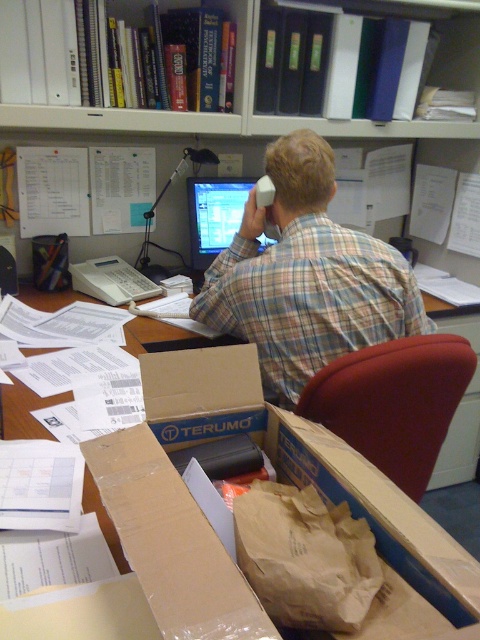
You are an office assistant who needs to place a new document on the desk. The document must be placed above the plaid shirt at center but below the matte plastic monitor at center. Is this possible?

The plaid shirt at center is positioned under the matte plastic monitor at center, so there is space between them where the document can be placed above the plaid shirt at center but below the matte plastic monitor at center.